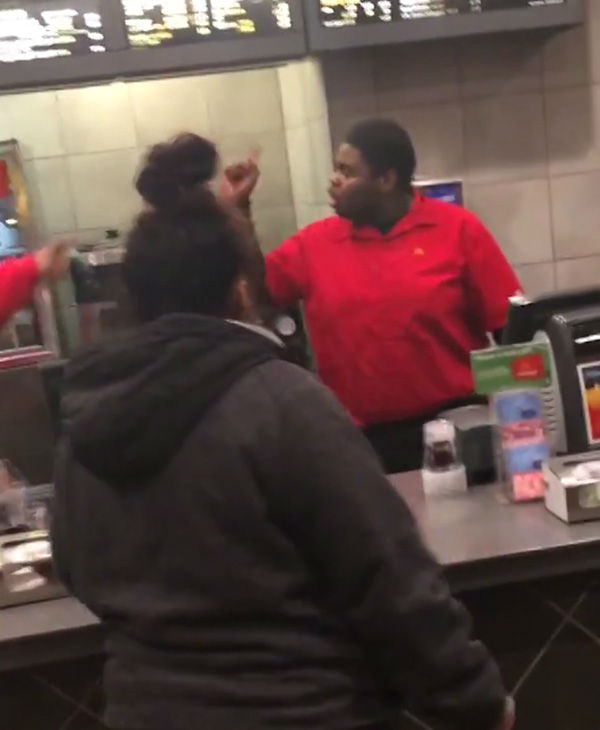
Where is `black front counter`? black front counter is located at coordinates (520, 629).